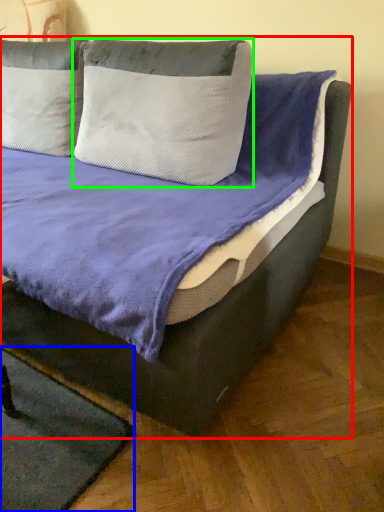
Question: Based on their relative distances, which object is nearer to bed (highlighted by a red box)? Choose from mat (highlighted by a blue box) and pillow (highlighted by a green box).

Choices:
 (A) mat
 (B) pillow

Answer: (B)